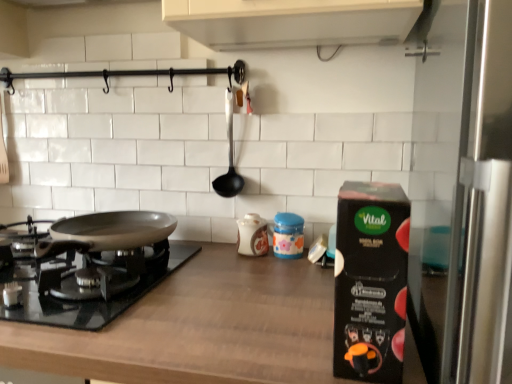
I want to click on vacant area that lies between silver metallic pan at lower left and black cardboard box at right, which appears as the 1th kitchen appliance when viewed from the front, so click(224, 306).